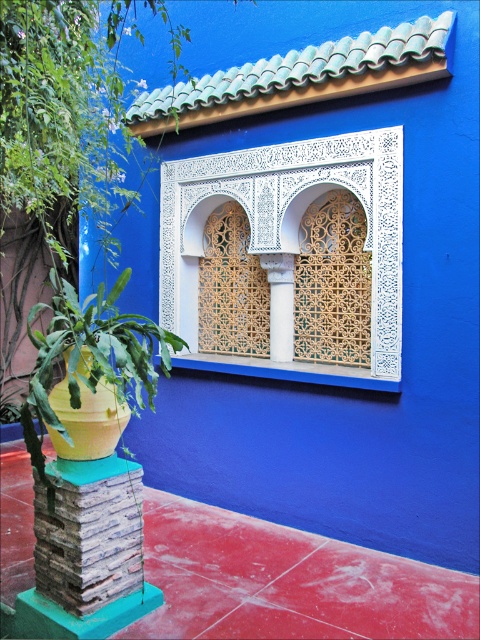
Does white lattice window at center have a greater height compared to white stone column at center?

Yes.

Describe the element at coordinates (287, 241) in the screenshot. I see `white lattice window at center` at that location.

Where is `white lattice window at center`? white lattice window at center is located at coordinates (287, 241).